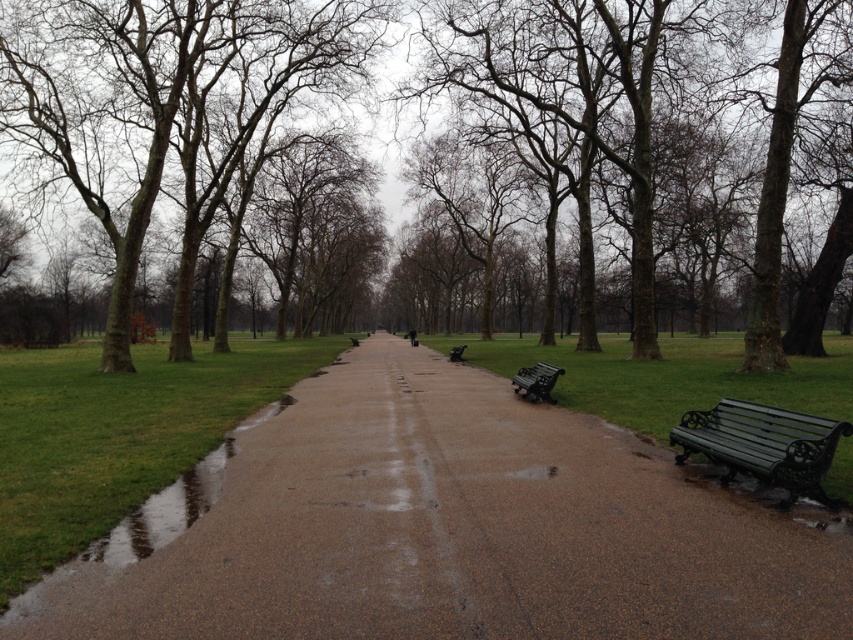
You are standing at the point marked as point (161,97) in the park scene. What object is located exactly at that point?

The point (161,97) corresponds to the brown textured tree at center.

Consider the image. You are standing at the starting point of the pathway in the park. You want to reach the brown smooth tree at center. Which direction should you walk to get there?

You should walk straight ahead along the pathway since the brown smooth tree at center is located at the center point of the path, which is directly ahead from your starting position.

You are standing at point (136, 177) and want to walk to point (380, 365). Which direction should you move relative to the path?

You should move forward along the path because point (380, 365) is in front of point (136, 177).